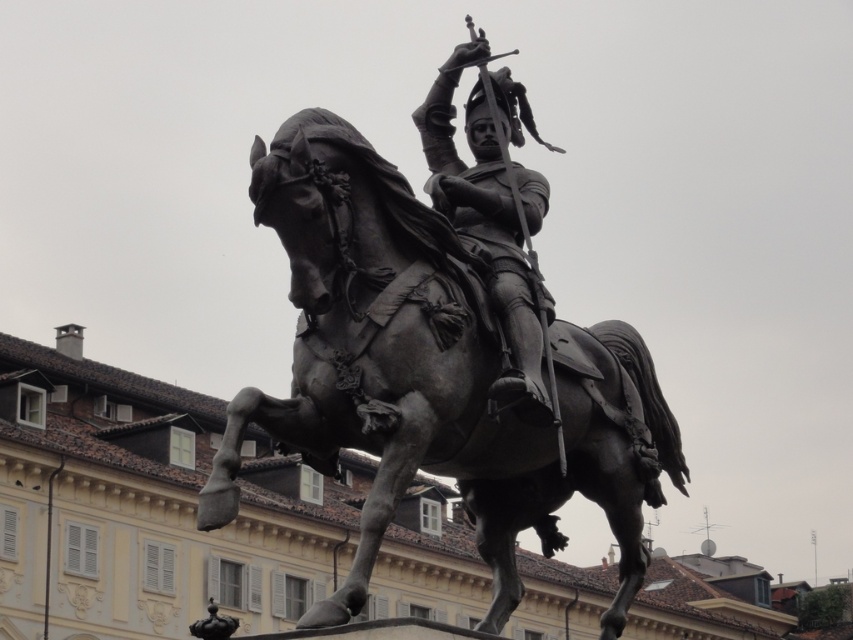
Question: Is bronze horse at center further to camera compared to polished bronze knight at center?

Choices:
 (A) yes
 (B) no

Answer: (B)

Question: Among these objects, which one is farthest from the camera?

Choices:
 (A) polished bronze knight at center
 (B) bronze horse at center

Answer: (A)

Question: Which object appears farthest from the camera in this image?

Choices:
 (A) bronze horse at center
 (B) polished bronze knight at center

Answer: (B)

Question: Is bronze horse at center thinner than polished bronze knight at center?

Choices:
 (A) no
 (B) yes

Answer: (A)

Question: In this image, where is bronze horse at center located relative to polished bronze knight at center?

Choices:
 (A) left
 (B) right

Answer: (A)